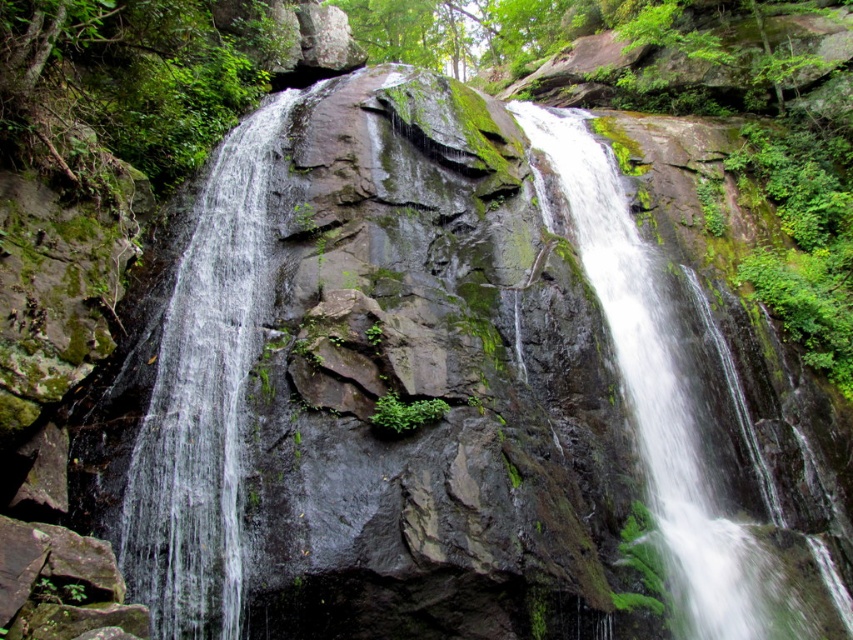
Question: Can you confirm if clear water at center is wider than green mossy rock at center?

Choices:
 (A) yes
 (B) no

Answer: (B)

Question: Among these points, which one is farthest from the camera?

Choices:
 (A) (561, 112)
 (B) (144, 563)

Answer: (A)

Question: Is clear water at center further to the viewer compared to green mossy rock at center?

Choices:
 (A) yes
 (B) no

Answer: (B)

Question: Is clear water at center positioned in front of green mossy rock at center?

Choices:
 (A) no
 (B) yes

Answer: (B)